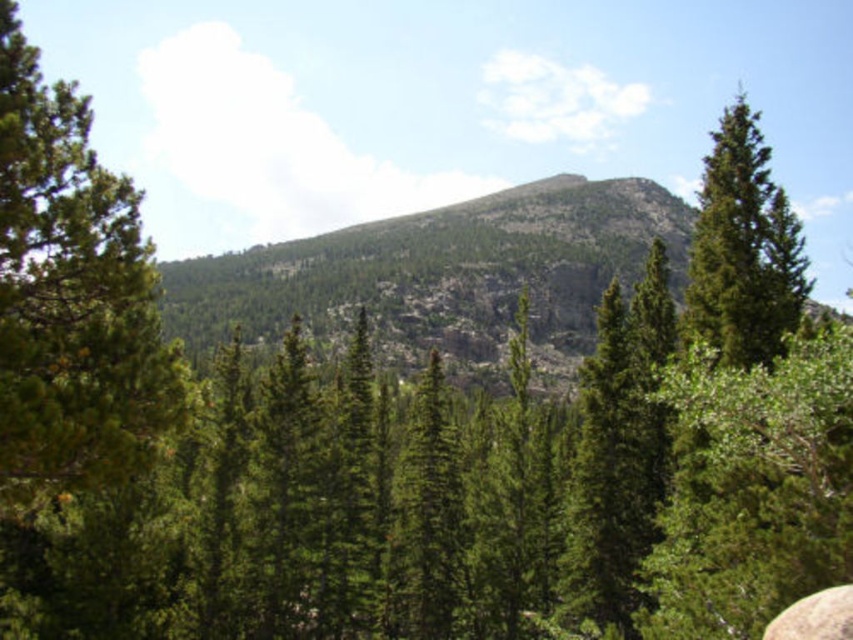
Question: Which object is the closest to the green matte tree at upper right?

Choices:
 (A) gray rough stone at lower right
 (B) green matte tree at left

Answer: (A)

Question: Among these objects, which one is nearest to the camera?

Choices:
 (A) gray rough stone at lower right
 (B) green matte tree at right
 (C) green matte tree at upper right
 (D) green matte tree at left

Answer: (D)

Question: Does green matte tree at left have a greater width compared to gray rough stone at lower right?

Choices:
 (A) no
 (B) yes

Answer: (B)

Question: Which point is closer to the camera taking this photo?

Choices:
 (A) (741, 113)
 (B) (827, 592)
 (C) (7, 339)

Answer: (C)

Question: Is green matte tree at right wider than green matte tree at upper right?

Choices:
 (A) no
 (B) yes

Answer: (A)

Question: Does green matte tree at left have a smaller size compared to green matte tree at right?

Choices:
 (A) no
 (B) yes

Answer: (B)